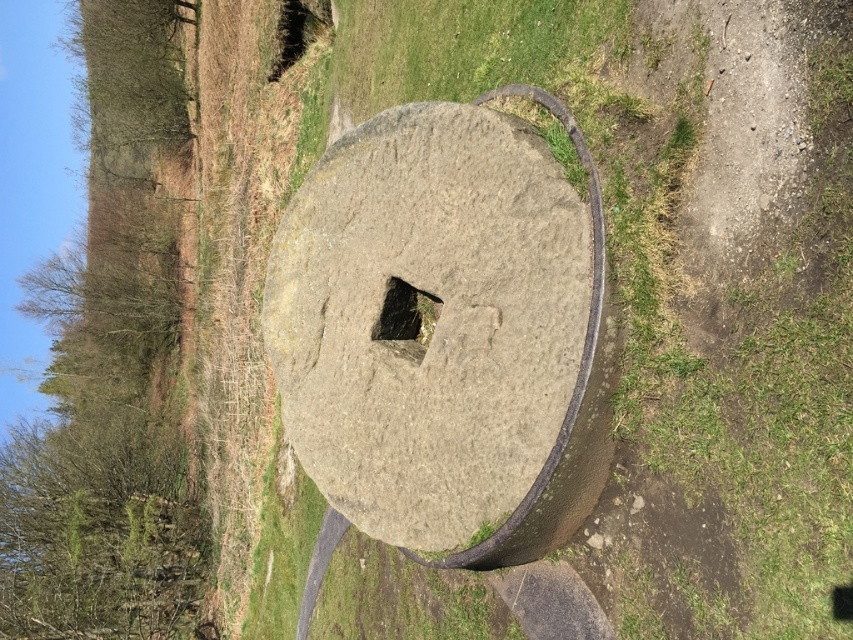
Based on the photo, which is below, green mossy stone at center or dark brown stone hole at upper center?

green mossy stone at center is lower down.

Is point (398, 323) in front of point (331, 20)?

Yes, it is in front of point (331, 20).

You are a GUI agent. You are given a task and a screenshot of the screen. Output one action in this format:
    pyautogui.click(x=<x>, y=<y>)
    Task: Click on the green mossy stone at center
    This screenshot has height=640, width=853.
    Given the screenshot: What is the action you would take?
    pyautogui.click(x=405, y=314)

Which is more to the left, gray stone at center or green mossy stone at center?

gray stone at center

Is gray stone at center thinner than green mossy stone at center?

Incorrect, gray stone at center's width is not less than green mossy stone at center's.

Locate an element on the screen. This screenshot has height=640, width=853. gray stone at center is located at coordinates (436, 321).

Does gray stone at center have a smaller size compared to dark brown stone hole at upper center?

Actually, gray stone at center might be larger than dark brown stone hole at upper center.

Does point (473, 316) come behind point (315, 28)?

No, it is not.

Image resolution: width=853 pixels, height=640 pixels. Describe the element at coordinates (436, 321) in the screenshot. I see `gray stone at center` at that location.

Where is `gray stone at center`? gray stone at center is located at coordinates (436, 321).